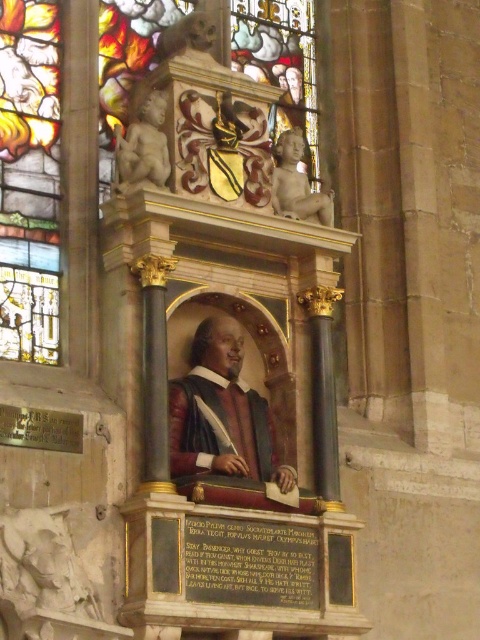
Question: Estimate the real-world distances between objects in this image. Which object is closer to the stained glass window at upper center?

Choices:
 (A) matte stone cherub at upper left
 (B) smooth wooden portrait at center

Answer: (A)

Question: Is stained glass window at upper center below smooth wooden portrait at center?

Choices:
 (A) yes
 (B) no

Answer: (B)

Question: Which point is closer to the camera?

Choices:
 (A) (252, 451)
 (B) (300, 176)
 (C) (132, 124)
 (D) (111, 52)

Answer: (A)

Question: Can you confirm if smooth wooden portrait at center is bigger than smooth marble cherub at upper right?

Choices:
 (A) no
 (B) yes

Answer: (B)

Question: Which object appears closest to the camera in this image?

Choices:
 (A) smooth marble cherub at upper right
 (B) matte stone cherub at upper left

Answer: (B)

Question: Is smooth wooden portrait at center positioned in front of smooth marble cherub at upper right?

Choices:
 (A) yes
 (B) no

Answer: (A)